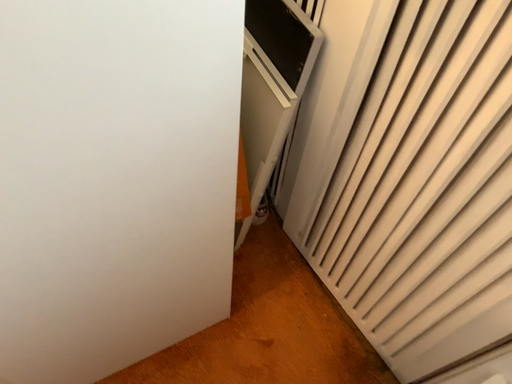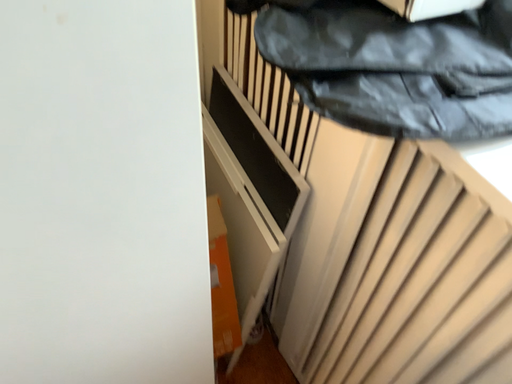
Question: How did the camera likely rotate when shooting the video?

Choices:
 (A) rotated downward
 (B) rotated upward

Answer: (B)